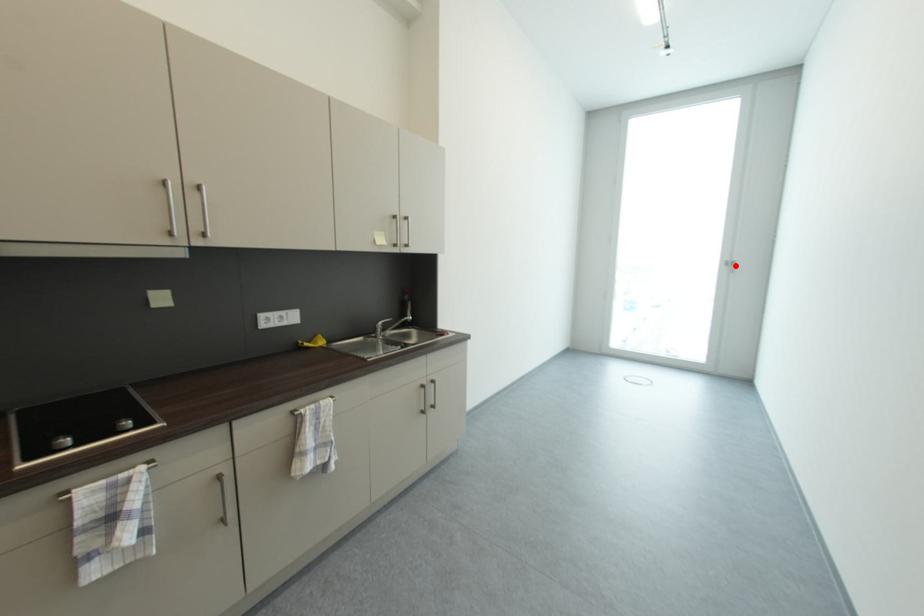
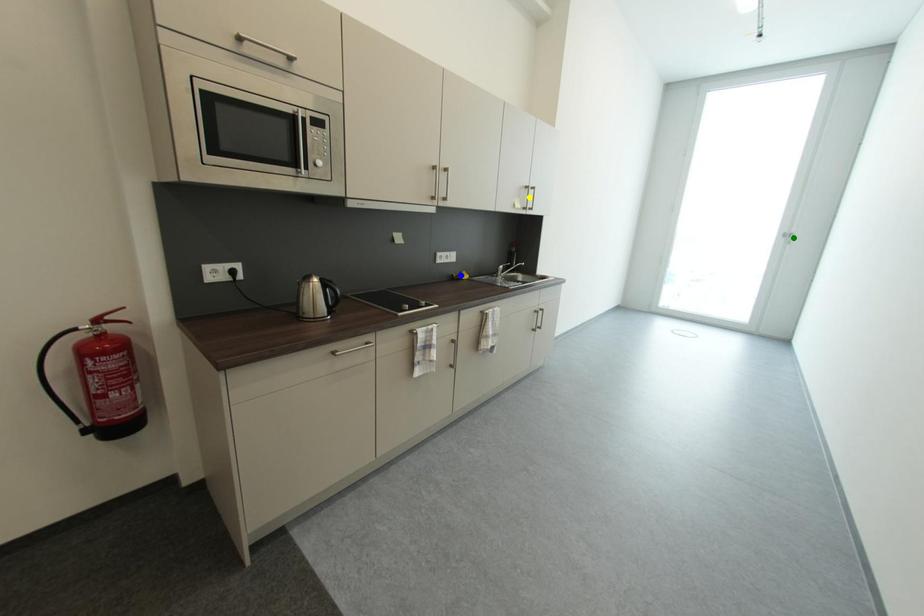
Question: I am providing you with two images of the same scene from different viewpoints. A red point is marked on the first image. You are given multiple points on the second image. In image 2, which mark is for the same physical point as the one in image 1?

Choices:
 (A) green point
 (B) blue point
 (C) yellow point

Answer: (A)